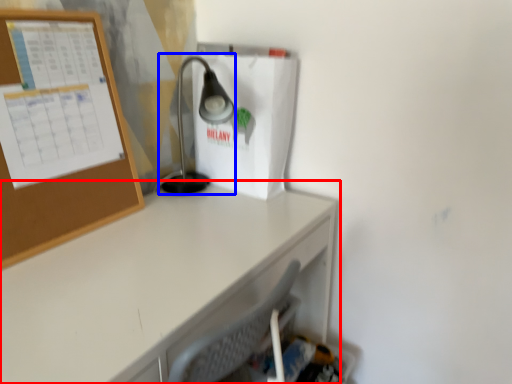
Question: Which point is further to the camera, desk (highlighted by a red box) or lamp (highlighted by a blue box)?

Choices:
 (A) desk
 (B) lamp

Answer: (B)